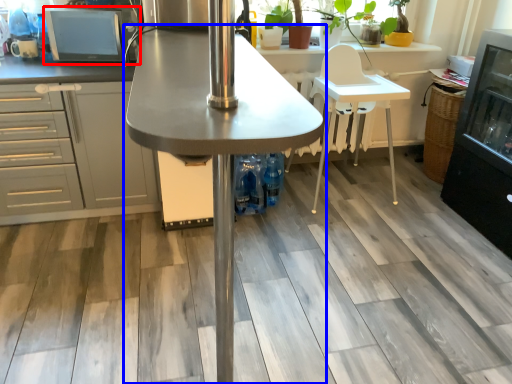
Question: Which object appears farthest to the camera in this image, appliance (highlighted by a red box) or table (highlighted by a blue box)?

Choices:
 (A) appliance
 (B) table

Answer: (A)